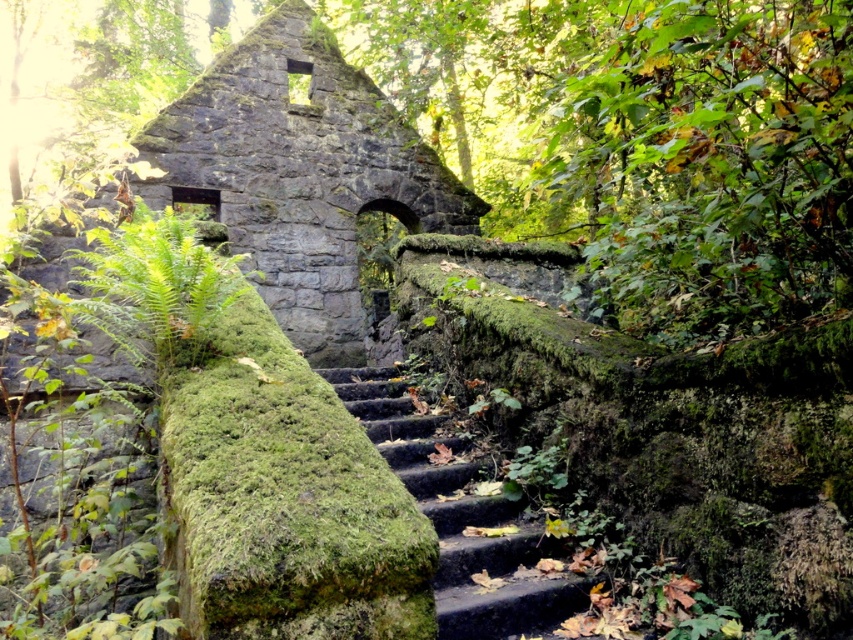
You are standing at the base of the rustic stone staircase in the image. There is a point marked at coordinates (299, 173). What does this point represent in the scene?

The point at coordinates (299, 173) corresponds to rusty stone ruins at center.